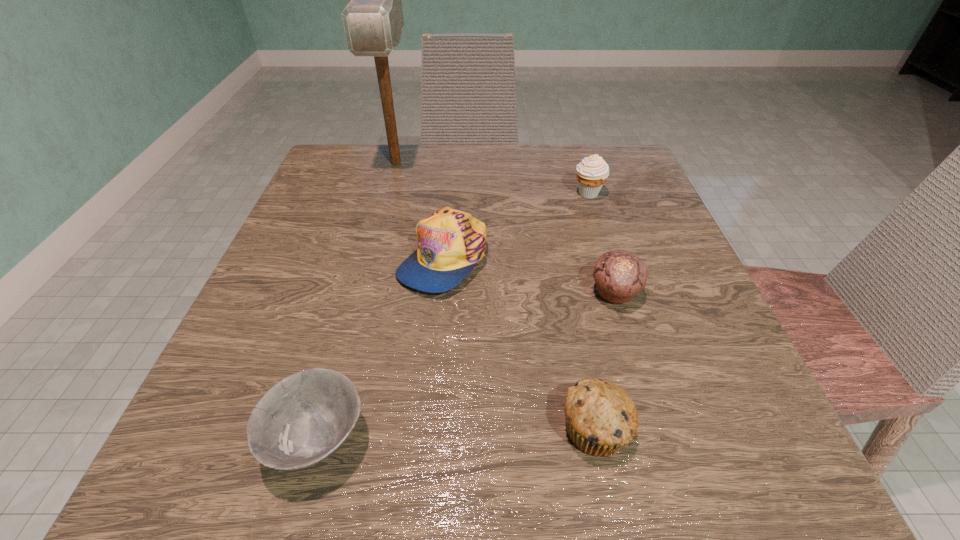
The width and height of the screenshot is (960, 540). In order to click on the tallest object in this screenshot , I will do `click(373, 20)`.

The width and height of the screenshot is (960, 540). In order to click on mallet in this screenshot , I will do `click(373, 20)`.

Where is `the farthest muffin`? The height and width of the screenshot is (540, 960). the farthest muffin is located at coordinates (592, 172).

The height and width of the screenshot is (540, 960). I want to click on the tallest muffin, so click(592, 172).

This screenshot has width=960, height=540. Find the location of `cap`. cap is located at coordinates (451, 242).

Where is `the second farthest muffin`? The image size is (960, 540). the second farthest muffin is located at coordinates pyautogui.click(x=619, y=275).

Where is `the nearest muffin`? Image resolution: width=960 pixels, height=540 pixels. the nearest muffin is located at coordinates (601, 418).

Identify the location of bowl. (303, 419).

At what (x,y) coordinates should I click in order to perform the action: click on free space located on the striking face of the farthest object. Please return your answer as a coordinate pair (x, y). The width and height of the screenshot is (960, 540). Looking at the image, I should click on (362, 289).

Identify the location of vacant space situated on the left of the farthest muffin. (549, 193).